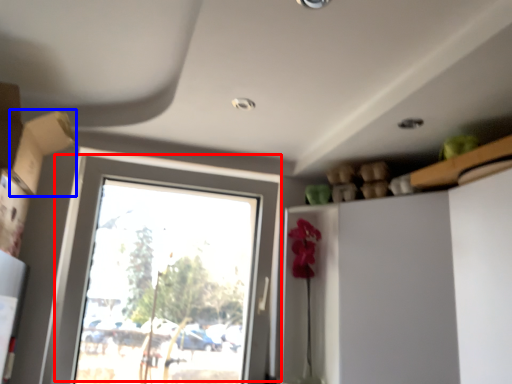
Question: Which object appears closest to the camera in this image, window (highlighted by a red box) or cardboard box (highlighted by a blue box)?

Choices:
 (A) window
 (B) cardboard box

Answer: (B)